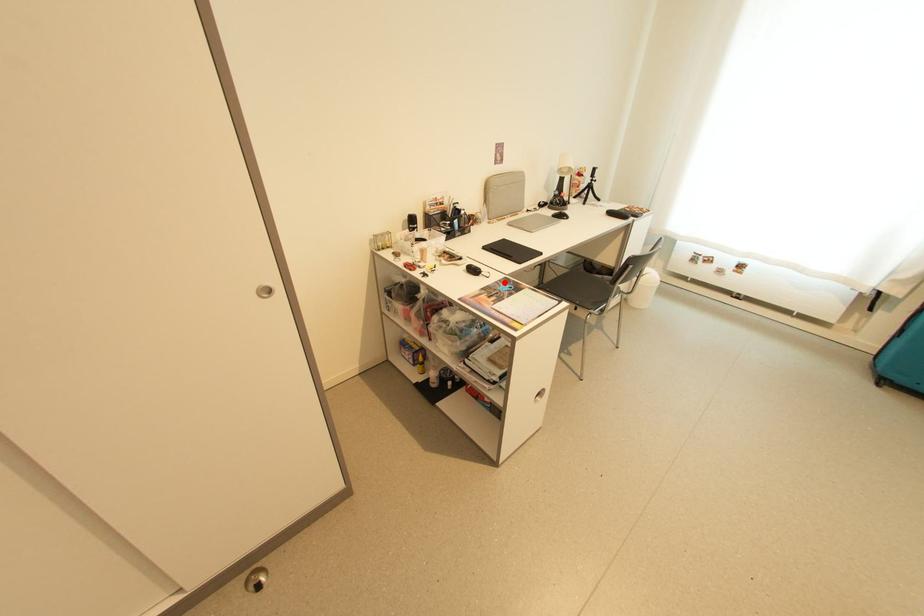
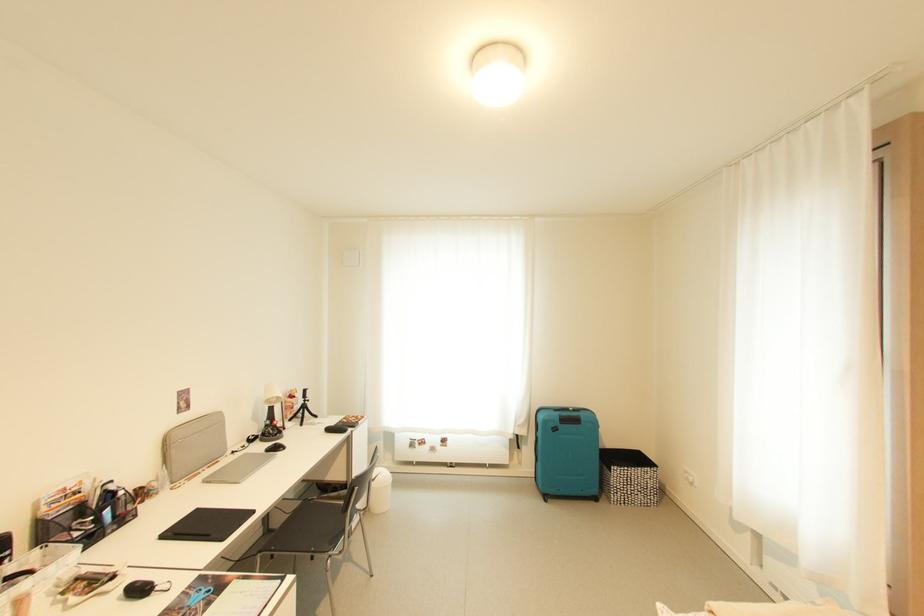
The point at the highlighted location is marked in the first image. Where is the corresponding point in the second image?

(195, 589)